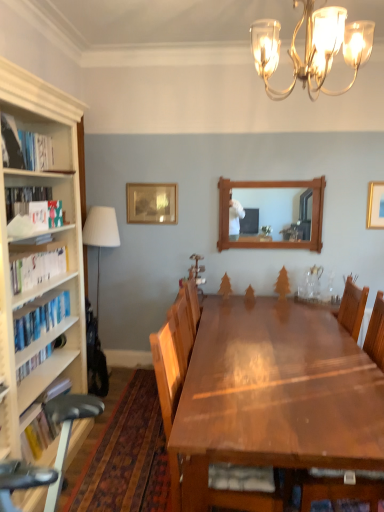
Question: From the image's perspective, is white fabric lampshade at left above wooden picture frame at upper center, arranged as the 2th picture frame when viewed from the right?

Choices:
 (A) no
 (B) yes

Answer: (A)

Question: Can you confirm if white fabric lampshade at left is wider than wooden picture frame at upper center, which appears as the 2th picture frame when viewed from the front?

Choices:
 (A) yes
 (B) no

Answer: (A)

Question: Is wooden picture frame at upper center, arranged as the 2th picture frame when viewed from the right, a part of white fabric lampshade at left?

Choices:
 (A) no
 (B) yes

Answer: (A)

Question: Can you confirm if white fabric lampshade at left is bigger than wooden picture frame at upper center, arranged as the 2th picture frame when viewed from the right?

Choices:
 (A) no
 (B) yes

Answer: (B)

Question: From a real-world perspective, is white fabric lampshade at left positioned over wooden picture frame at upper center, which appears as the 2th picture frame when viewed from the front, based on gravity?

Choices:
 (A) no
 (B) yes

Answer: (A)

Question: Is wooden picture frame at upper center, the first picture frame in the back-to-front sequence, at the back of white fabric lampshade at left?

Choices:
 (A) yes
 (B) no

Answer: (B)

Question: Is wooden picture frame at upper center, arranged as the 2th picture frame when viewed from the right, completely or partially outside of hardcover book at left, which appears as the fourth book when ordered from the bottom?

Choices:
 (A) no
 (B) yes

Answer: (B)

Question: Does wooden picture frame at upper center, the first picture frame in the back-to-front sequence, appear on the left side of hardcover book at left, which appears as the fourth book when ordered from the bottom?

Choices:
 (A) no
 (B) yes

Answer: (A)

Question: Is wooden picture frame at upper center, which appears as the 2th picture frame when viewed from the front, wider than hardcover book at left, the 2th book when ordered from top to bottom?

Choices:
 (A) no
 (B) yes

Answer: (A)

Question: Can you confirm if wooden picture frame at upper center, which is the first picture frame from left to right, is taller than hardcover book at left, the 2th book when ordered from top to bottom?

Choices:
 (A) no
 (B) yes

Answer: (B)

Question: From the image's perspective, is wooden picture frame at upper center, which appears as the 2th picture frame when viewed from the front, over hardcover book at left, which appears as the fourth book when ordered from the bottom?

Choices:
 (A) yes
 (B) no

Answer: (A)

Question: Does wooden picture frame at upper center, arranged as the 2th picture frame when viewed from the right, appear on the right side of hardcover book at left, the 2th book when ordered from top to bottom?

Choices:
 (A) yes
 (B) no

Answer: (A)

Question: Is wooden picture frame at upper center, which is the first picture frame from left to right, completely or partially inside gold metallic chandelier at upper center?

Choices:
 (A) no
 (B) yes

Answer: (A)